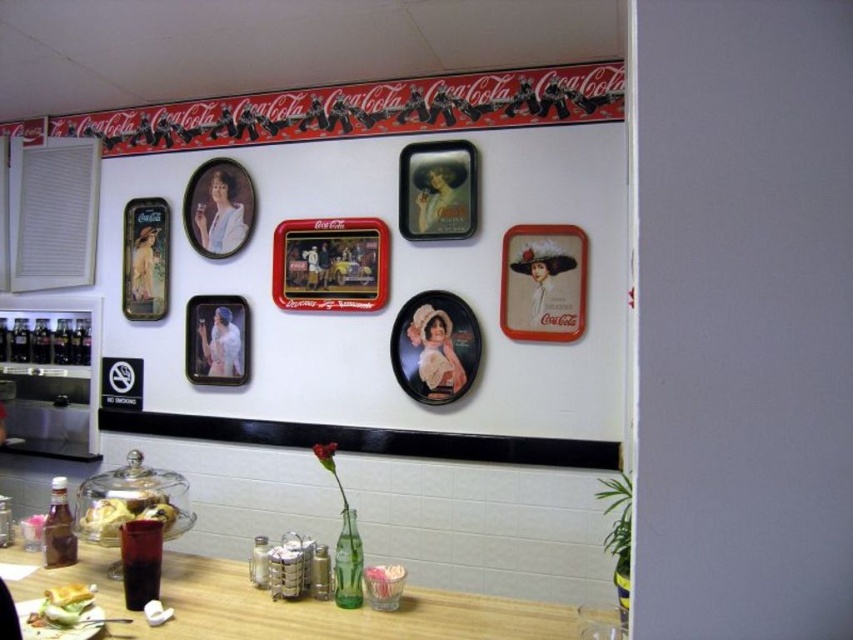
Could you measure the distance between metallic rectangular tray at center and matte black rectangular frame at upper left?

They are 72.94 centimeters apart.

Which is behind, point (335, 291) or point (144, 216)?

Positioned behind is point (144, 216).

Who is more forward, (x=289, y=268) or (x=154, y=205)?

Point (x=289, y=268)

The image size is (853, 640). Identify the location of metallic rectangular tray at center. (329, 264).

Where is `metallic rectangular tray at center`? The height and width of the screenshot is (640, 853). metallic rectangular tray at center is located at coordinates (329, 264).

Is point (294, 241) in front of point (42, 625)?

No, it is behind (42, 625).

You are a GUI agent. You are given a task and a screenshot of the screen. Output one action in this format:
    pyautogui.click(x=<x>, y=<y>)
    Task: Click on the metallic rectangular tray at center
    This screenshot has width=853, height=640.
    Given the screenshot: What is the action you would take?
    pyautogui.click(x=329, y=264)

Can you confirm if metallic silver picture frame at center is taller than matte green lettuce at lower left?

Indeed, metallic silver picture frame at center has a greater height compared to matte green lettuce at lower left.

Is metallic silver picture frame at center positioned in front of matte green lettuce at lower left?

No, it is not.

Between point (460, 172) and point (90, 602), which one is positioned behind?

Point (460, 172)

This screenshot has height=640, width=853. What are the coordinates of `metallic silver picture frame at center` in the screenshot? It's located at (437, 189).